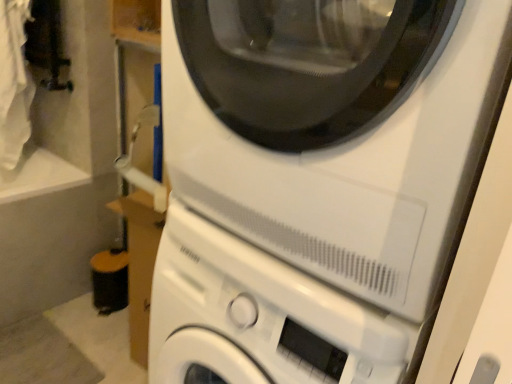
Question: From the image's perspective, is white matte washing machine at center, which is counted as the second washing machine, starting from the top, located above or below white matte washing machine at center, the first washing machine viewed from the top?

Choices:
 (A) above
 (B) below

Answer: (B)

Question: From a real-world perspective, is white matte washing machine at center, which is counted as the second washing machine, starting from the top, positioned above or below white matte washing machine at center, which is the 2th washing machine from bottom to top?

Choices:
 (A) above
 (B) below

Answer: (B)

Question: Is white matte washing machine at center, placed as the first washing machine when sorted from bottom to top, wider or thinner than white matte washing machine at center, which is the 2th washing machine from bottom to top?

Choices:
 (A) thin
 (B) wide

Answer: (B)

Question: Is white matte washing machine at center, which is the 2th washing machine from bottom to top, to the left or to the right of white matte washing machine at center, which is counted as the second washing machine, starting from the top, in the image?

Choices:
 (A) right
 (B) left

Answer: (A)

Question: Is white matte washing machine at center, which is the 2th washing machine from bottom to top, wider or thinner than white matte washing machine at center, placed as the first washing machine when sorted from bottom to top?

Choices:
 (A) thin
 (B) wide

Answer: (A)

Question: In terms of size, does white matte washing machine at center, which is the 2th washing machine from bottom to top, appear bigger or smaller than white matte washing machine at center, which is counted as the second washing machine, starting from the top?

Choices:
 (A) small
 (B) big

Answer: (A)

Question: Does point (181, 11) appear closer or farther from the camera than point (268, 355)?

Choices:
 (A) farther
 (B) closer

Answer: (B)